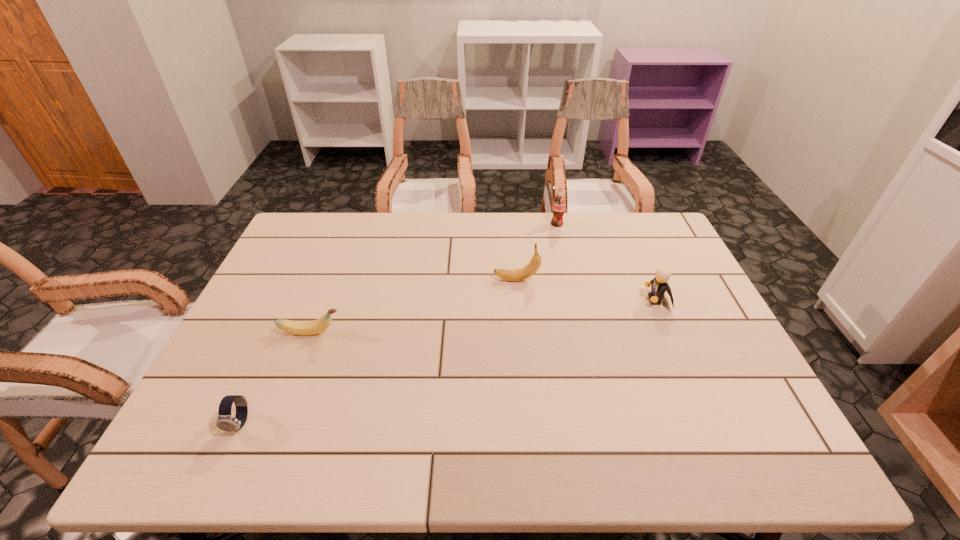
Find the location of a particular element. watch present at the left edge is located at coordinates (226, 422).

In order to click on object at the right edge in this screenshot , I will do `click(659, 285)`.

Find the location of a particular element. This screenshot has height=540, width=960. object at the near left corner is located at coordinates (226, 422).

The image size is (960, 540). Find the location of `blank space at the far edge of the desktop`. blank space at the far edge of the desktop is located at coordinates (603, 253).

In the image, there is a desktop. Find the location of `vacant space at the near edge`. vacant space at the near edge is located at coordinates (712, 468).

Locate an element on the screen. free space at the left edge is located at coordinates (283, 262).

In the image, there is a desktop. Identify the location of free region at the right edge. (702, 333).

The width and height of the screenshot is (960, 540). In order to click on vacant space at the far right corner of the desktop in this screenshot , I will do `click(647, 221)`.

I want to click on vacant point at the near right corner, so click(753, 465).

You are a GUI agent. You are given a task and a screenshot of the screen. Output one action in this format:
    pyautogui.click(x=<x>, y=<y>)
    Task: Click on the free point between the soda and the Lego
    The height and width of the screenshot is (540, 960).
    Given the screenshot: What is the action you would take?
    pyautogui.click(x=607, y=262)